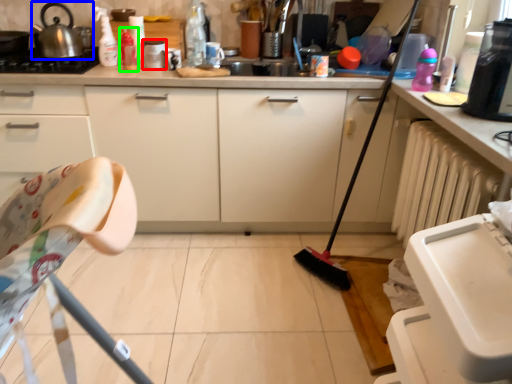
Question: Which is nearer to the appliance (highlighted by a red box)? tea pot (highlighted by a blue box) or bottle (highlighted by a green box).

Choices:
 (A) tea pot
 (B) bottle

Answer: (B)